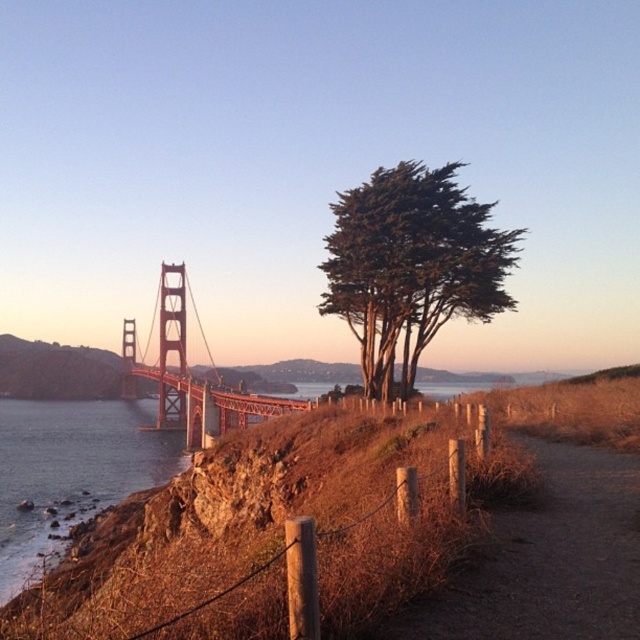
Can you confirm if brown dirt path at center is smaller than red-orange metallic bridge at left?

Indeed, brown dirt path at center has a smaller size compared to red-orange metallic bridge at left.

Which is below, brown dirt path at center or red-orange metallic bridge at left?

red-orange metallic bridge at left

Is point (442, 605) positioned after point (161, 282)?

No.

The width and height of the screenshot is (640, 640). I want to click on brown dirt path at center, so click(x=548, y=560).

Is point (438, 321) closer to camera compared to point (176, 358)?

Yes.

Does green textured tree at center have a larger size compared to red-orange metallic bridge at left?

Incorrect, green textured tree at center is not larger than red-orange metallic bridge at left.

Does point (365, 312) come farther from viewer compared to point (163, 269)?

No, it is in front of (163, 269).

The height and width of the screenshot is (640, 640). I want to click on green textured tree at center, so click(x=412, y=264).

Between clear water at lower left and red-orange metallic bridge at left, which one appears on the right side from the viewer's perspective?

From the viewer's perspective, clear water at lower left appears more on the right side.

Is clear water at lower left wider than red-orange metallic bridge at left?

In fact, clear water at lower left might be narrower than red-orange metallic bridge at left.

Is point (24, 476) positioned in front of point (189, 413)?

Yes, it is in front of point (189, 413).

Locate an element on the screen. This screenshot has height=640, width=640. clear water at lower left is located at coordinates (70, 472).